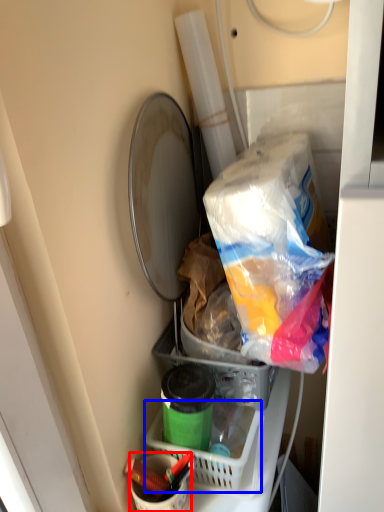
Question: Which object is closer to the camera taking this photo, bucket (highlighted by a red box) or basket (highlighted by a blue box)?

Choices:
 (A) bucket
 (B) basket

Answer: (A)